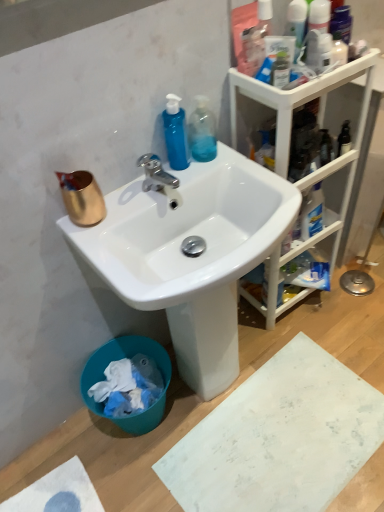
The image size is (384, 512). In order to click on vacant space that is in between copper metallic cup at upper left and chrome metallic faucet at upper center in this screenshot , I will do `click(125, 205)`.